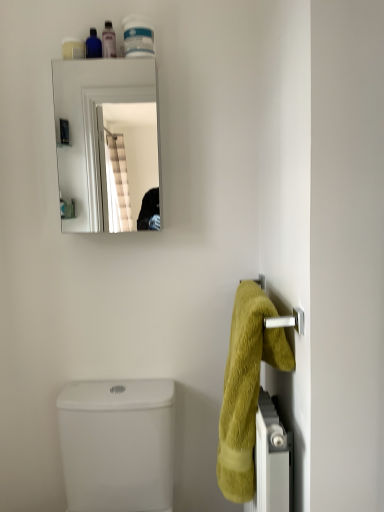
Question: Is translucent plastic bottle at upper center, the 3th toiletry viewed from the left, wider or thinner than clear glass mirror at upper center?

Choices:
 (A) wide
 (B) thin

Answer: (B)

Question: Is point (110, 36) closer or farther from the camera than point (112, 165)?

Choices:
 (A) farther
 (B) closer

Answer: (B)

Question: Estimate the real-world distances between objects in this image. Which object is farther from the matte white soap at upper left, marked as the 1th toiletry in a left-to-right arrangement?

Choices:
 (A) soft yellow towel at right
 (B) white glossy container at upper center, which is the first toiletry from right to left
 (C) clear glass mirror at upper center
 (D) white glossy toilet bowl at lower left
 (E) translucent plastic bottle at upper center, the 3th toiletry viewed from the left

Answer: (C)

Question: Estimate the real-world distances between objects in this image. Which object is closer to the white glossy toilet bowl at lower left?

Choices:
 (A) soft yellow towel at right
 (B) matte blue bottle at upper left, the third toiletry viewed from the right
 (C) clear glass mirror at upper center
 (D) white glossy container at upper center, which is the first toiletry from right to left
 (E) translucent plastic bottle at upper center, the 3th toiletry viewed from the left

Answer: (A)